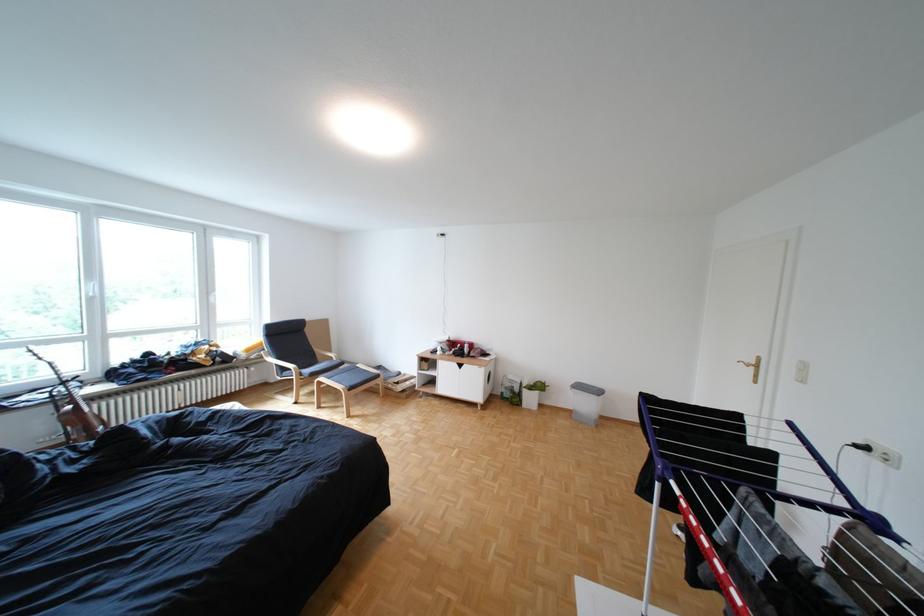
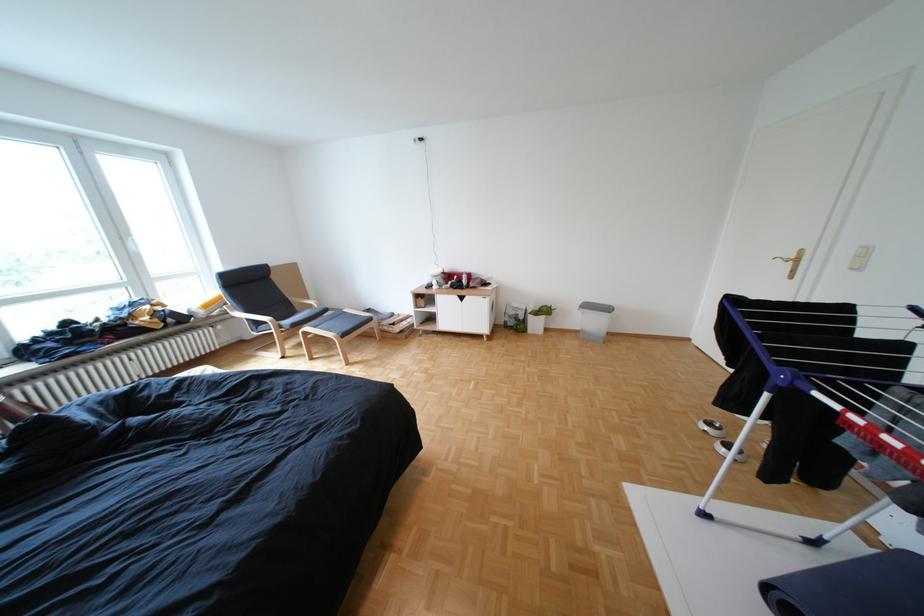
Locate, in the second image, the point that corresponds to [594,387] in the first image.

(603, 306)